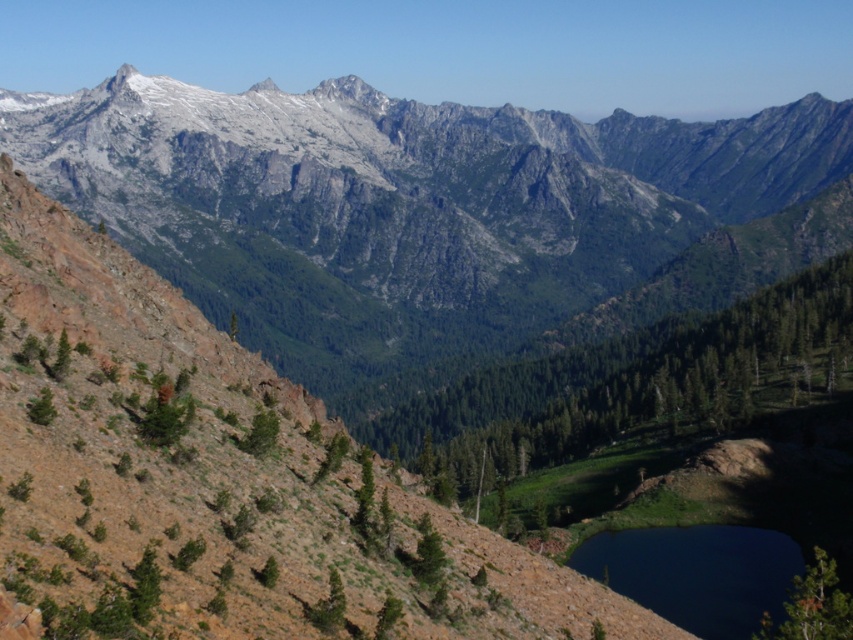
Based on the scene description, what can be found at the coordinates point (x=434, y=224)?

At point (x=434, y=224) lies the gray rocky mountain range at upper center.

You are a hiker planning to cross from the gray rocky mountain range at upper center to the deep blue water at lower center. The trail is straight and there are no obstacles. How far will you have to walk in feet?

The gray rocky mountain range at upper center is 568.41 feet away from deep blue water at lower center, so you will have to walk 568.41 feet.

You are a hiker planning to cross the deep blue water at lower center and reach the gray rocky mountain range at upper center. Based on the scene, which object would you encounter first if you start from the lower part of the image?

You would first encounter the deep blue water at lower center before reaching the gray rocky mountain range at upper center because the mountain range is positioned higher up in the scene.